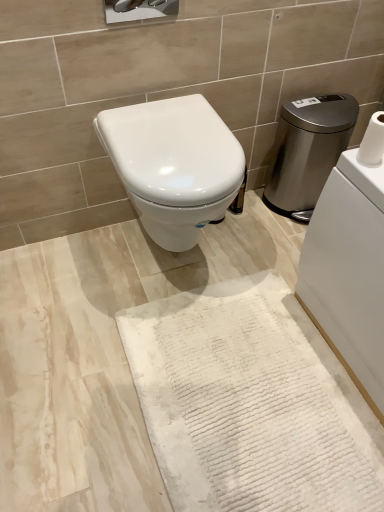
Find the location of a particular element. This screenshot has width=384, height=512. vacant space in white textured bath mat at center (from a real-world perspective) is located at coordinates (236, 398).